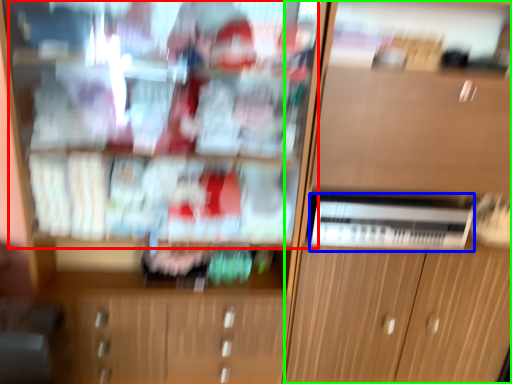
Question: Based on their relative distances, which object is farther from shelf (highlighted by a red box)? Choose from appliance (highlighted by a blue box) and cabinetry (highlighted by a green box).

Choices:
 (A) appliance
 (B) cabinetry

Answer: (A)